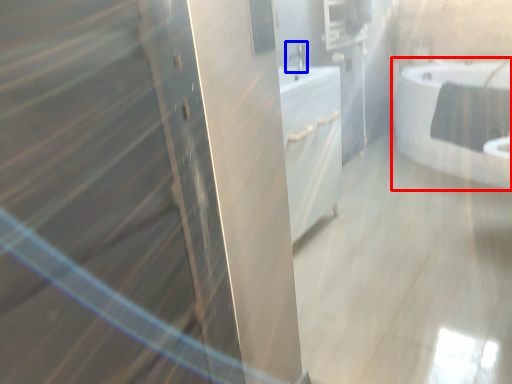
Question: Which point is closer to the camera, bathtub (highlighted by a red box) or faucet (highlighted by a blue box)?

Choices:
 (A) bathtub
 (B) faucet

Answer: (B)